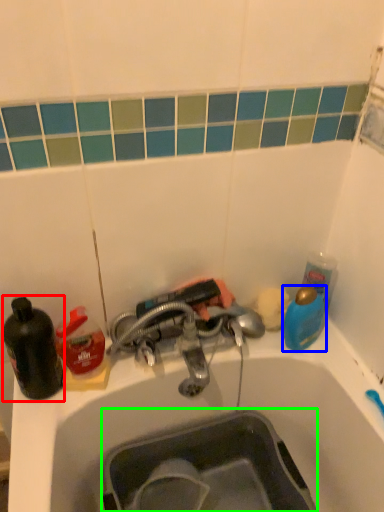
Question: Which object is the farthest from bottle (highlighted by a red box)? Choose among these: teal (highlighted by a blue box) or sink (highlighted by a green box).

Choices:
 (A) teal
 (B) sink

Answer: (A)